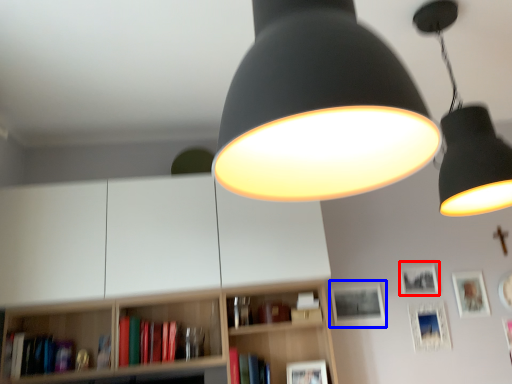
Question: Among these objects, which one is nearest to the camera, picture frame (highlighted by a red box) or picture frame (highlighted by a blue box)?

Choices:
 (A) picture frame
 (B) picture frame

Answer: (B)